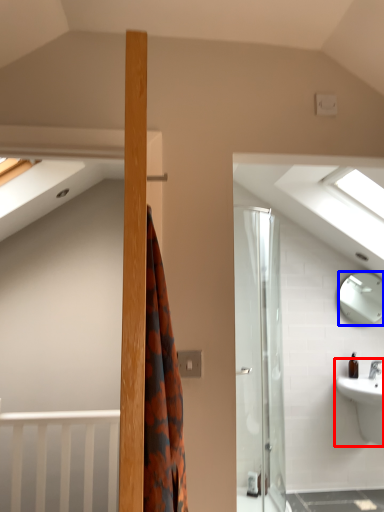
Question: Which of the following is the farthest to the observer, sink (highlighted by a red box) or mirror (highlighted by a blue box)?

Choices:
 (A) sink
 (B) mirror

Answer: (B)